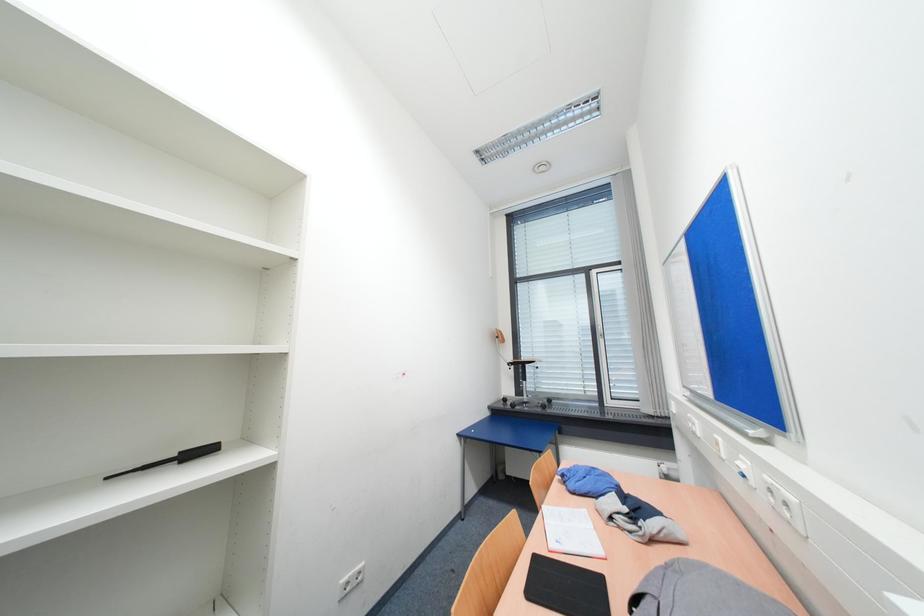
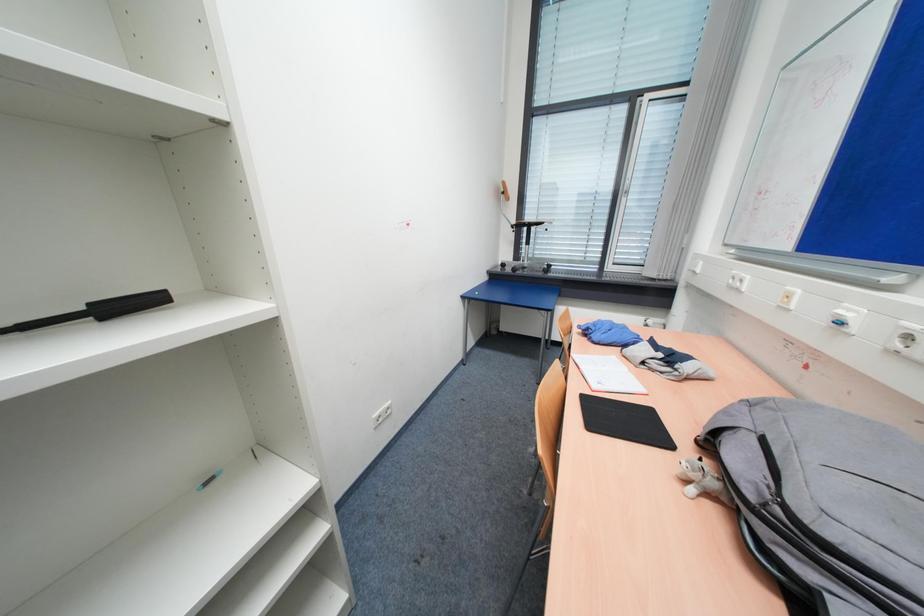
Which direction would the cameraman need to move to produce the second image?

The cameraman moved toward left, forward.